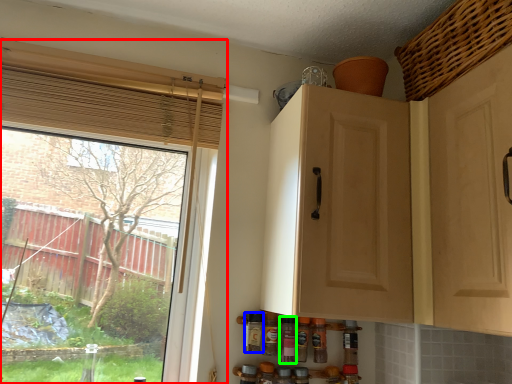
Question: Considering the real-world distances, which object is farthest from window (highlighted by a red box)? bottle (highlighted by a blue box) or bottle (highlighted by a green box)?

Choices:
 (A) bottle
 (B) bottle

Answer: (B)